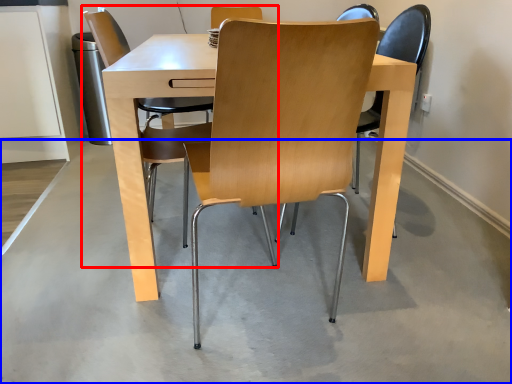
Question: Which point is further to the camera, chair (highlighted by a red box) or concrete (highlighted by a blue box)?

Choices:
 (A) chair
 (B) concrete

Answer: (A)